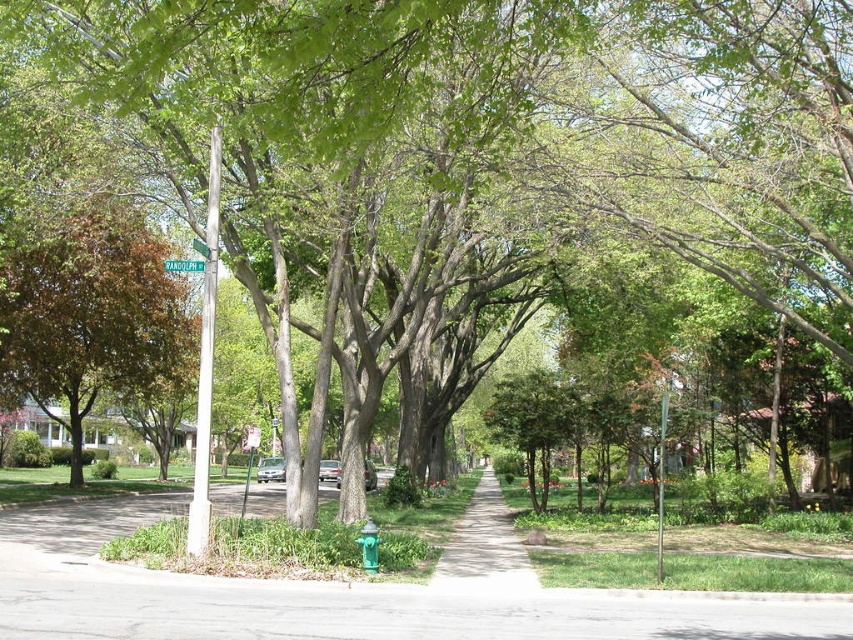
You are standing at the point marked by the coordinates point (90, 316) in the image. What object is located at that point?

The point (90, 316) marks the location of the brown leafy tree at left.

You are a delivery person trying to park your bike on the gray asphalt pavement at center. The bike requires a space wider than the green plastic street sign at upper center. Can you park your bike there?

The gray asphalt pavement at center is wider than the green plastic street sign at upper center, so yes, the bike can be parked there as the pavement provides sufficient width.